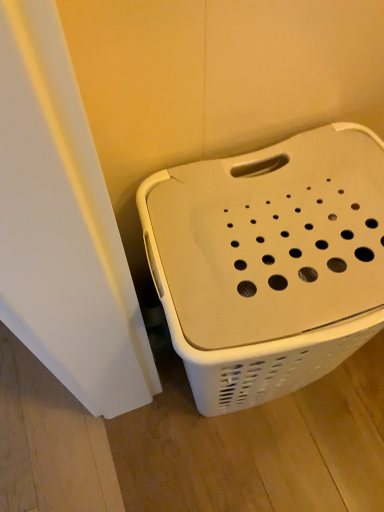
In the scene shown: Measure the distance between point (355, 187) and camera.

Point (355, 187) and camera are 25.83 inches apart from each other.

Describe the element at coordinates (269, 262) in the screenshot. I see `white plastic laundry basket at lower right` at that location.

Where is `white plastic laundry basket at lower right`? white plastic laundry basket at lower right is located at coordinates (269, 262).

This screenshot has height=512, width=384. What are the coordinates of `white plastic laundry basket at lower right` in the screenshot? It's located at (269, 262).